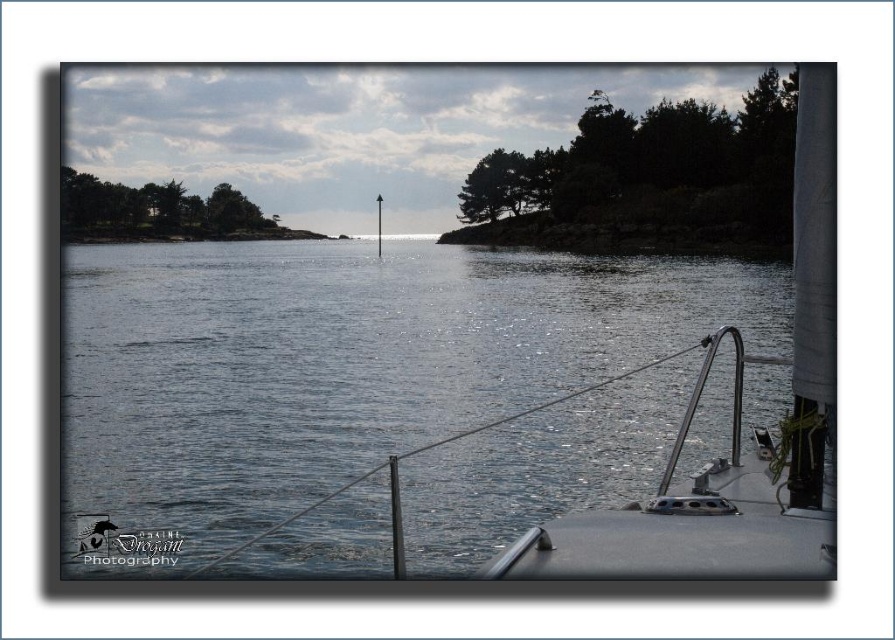
Is glossy water at center shorter than polished stainless steel boat at right?

In fact, glossy water at center may be taller than polished stainless steel boat at right.

Image resolution: width=895 pixels, height=640 pixels. What are the coordinates of `glossy water at center` in the screenshot? It's located at (346, 360).

Locate an element on the screen. The image size is (895, 640). glossy water at center is located at coordinates (346, 360).

Where is `glossy water at center`? glossy water at center is located at coordinates (x=346, y=360).